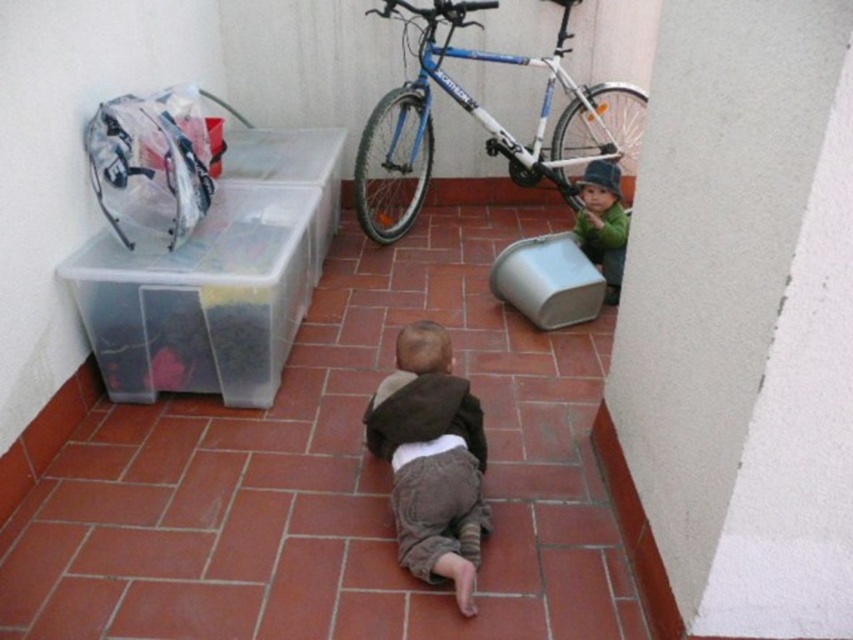
Who is more forward, (403, 504) or (589, 220)?

Point (403, 504) is in front.

Between brown soft fabric at center and green fuzzy hat at lower right, which one appears on the left side from the viewer's perspective?

From the viewer's perspective, brown soft fabric at center appears more on the left side.

Is point (390, 397) closer to camera compared to point (582, 244)?

That is True.

You are a GUI agent. You are given a task and a screenshot of the screen. Output one action in this format:
    pyautogui.click(x=<x>, y=<y>)
    Task: Click on the brown soft fabric at center
    This screenshot has width=853, height=640.
    Given the screenshot: What is the action you would take?
    pyautogui.click(x=432, y=460)

Between blue metallic bicycle at upper center and green fuzzy hat at lower right, which one has less height?

With less height is green fuzzy hat at lower right.

Measure the distance between point (x=506, y=56) and camera.

3.39 meters

Between point (555, 74) and point (602, 236), which one is positioned in front?

Point (602, 236) is more forward.

This screenshot has height=640, width=853. What are the coordinates of `blue metallic bicycle at upper center` in the screenshot? It's located at (479, 122).

Can you confirm if blue metallic bicycle at upper center is smaller than brown soft fabric at center?

No.

Can you confirm if blue metallic bicycle at upper center is taller than brown soft fabric at center?

Yes, blue metallic bicycle at upper center is taller than brown soft fabric at center.

Locate an element on the screen. blue metallic bicycle at upper center is located at coordinates (479, 122).